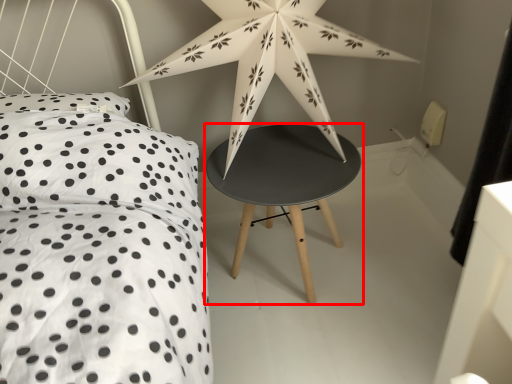
Question: Considering the relative positions of stool (annotated by the red box) and star in the image provided, where is stool (annotated by the red box) located with respect to the staircase?

Choices:
 (A) left
 (B) right

Answer: (B)